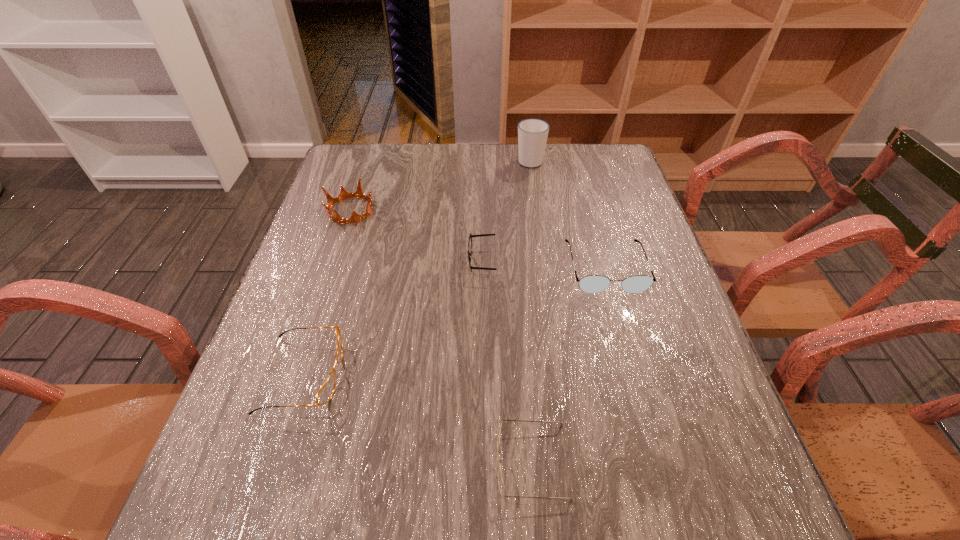
Locate an element on the screen. The image size is (960, 540). the tallest object is located at coordinates (532, 133).

Where is `cup`? The height and width of the screenshot is (540, 960). cup is located at coordinates (532, 133).

I want to click on crown, so click(359, 193).

Locate an element on the screen. the rightmost object is located at coordinates (592, 284).

I want to click on the third farthest spectacles, so click(x=325, y=393).

Identify the location of the fifth farthest object. (325, 393).

Find the location of a particular element. The height and width of the screenshot is (540, 960). the nearest spectacles is located at coordinates (500, 480).

The image size is (960, 540). What are the coordinates of `vacant space located 0.150m on the right of the fifth nearest object` in the screenshot? It's located at (431, 210).

At what (x,y) coordinates should I click in order to perform the action: click on vacant space located 0.240m on the lenses of the rightmost spectacles. Please return your answer as a coordinate pair (x, y). This screenshot has width=960, height=540. Looking at the image, I should click on (639, 390).

What are the coordinates of `vacant space located on the front-facing side of the second nearest spectacles` in the screenshot? It's located at (487, 375).